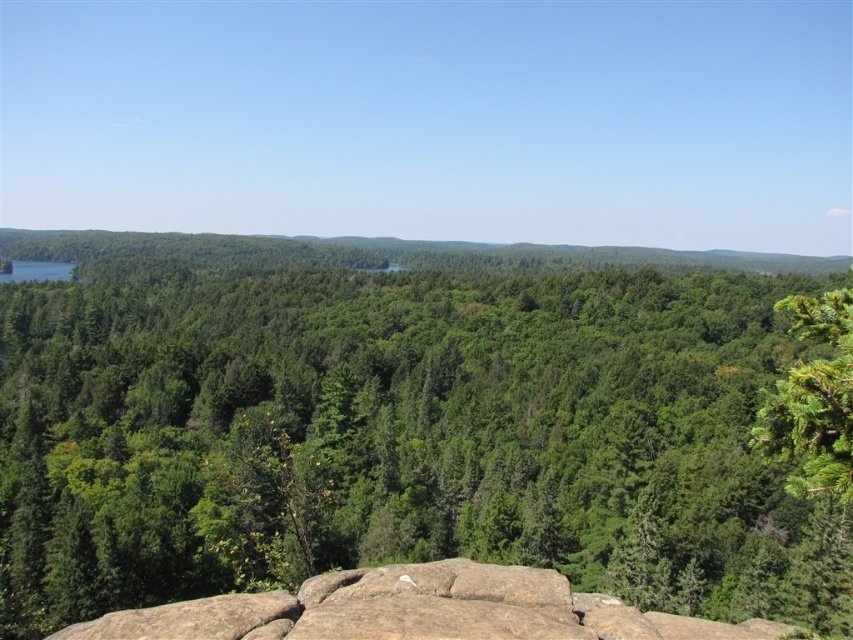
Based on the photo, can you confirm if green leafy forest at center is positioned below brown rough rock at bottom center?

Incorrect, green leafy forest at center is not positioned below brown rough rock at bottom center.

Is green leafy forest at center in front of brown rough rock at bottom center?

That is True.

Between point (381, 458) and point (410, 566), which one is positioned behind?

The point (381, 458) is more distant.

The height and width of the screenshot is (640, 853). In order to click on green leafy forest at center in this screenshot , I will do `click(399, 422)`.

The image size is (853, 640). Identify the location of brown rough rock at bottom center. (415, 611).

Is point (132, 616) closer to viewer compared to point (843, 362)?

No, (132, 616) is further to viewer.

Image resolution: width=853 pixels, height=640 pixels. Identify the location of brown rough rock at bottom center. (415, 611).

Consider the image. Who is higher up, green leafy forest at center or green textured pine tree at right?

green leafy forest at center is higher up.

Which is in front, point (556, 451) or point (838, 296)?

Point (838, 296)

The width and height of the screenshot is (853, 640). I want to click on green leafy forest at center, so click(x=399, y=422).